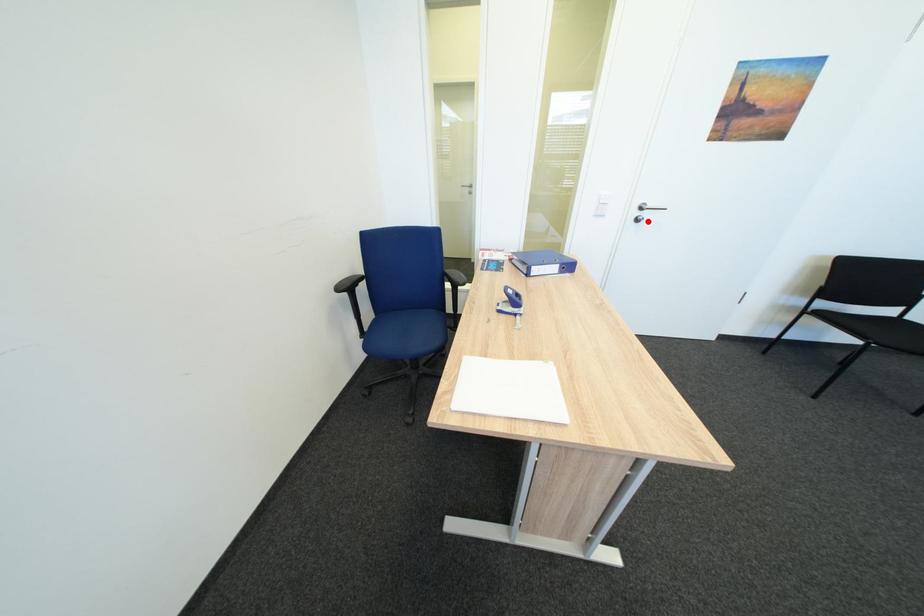
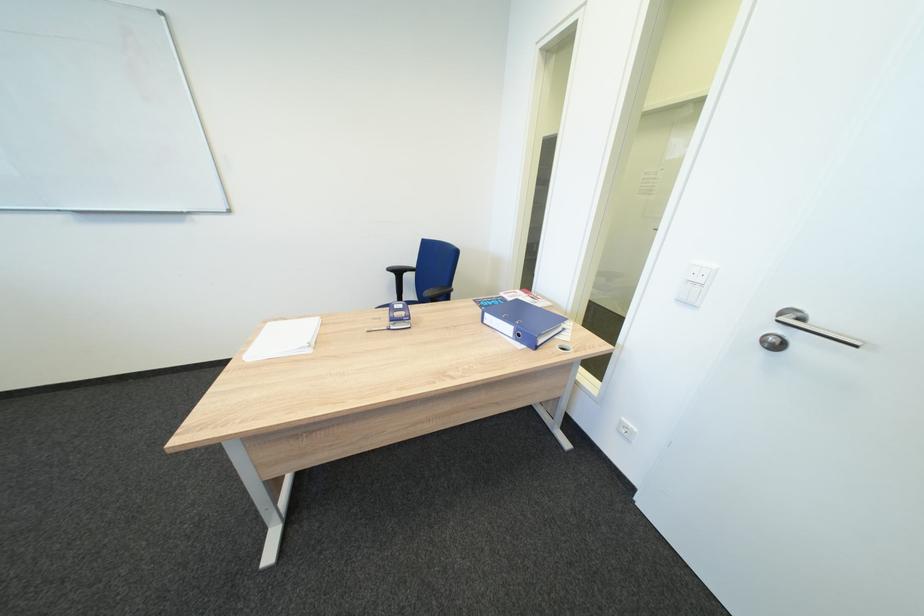
Question: I am providing you with two images of the same scene from different viewpoints. A red point is marked on the first image. Is the red point's position out of view in image 2?

Choices:
 (A) Yes
 (B) No

Answer: (B)